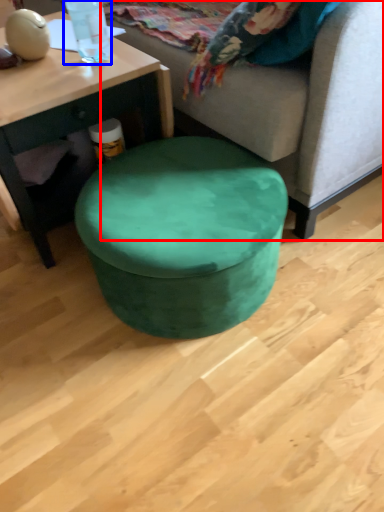
Question: Which of the following is the closest to the observer, studio couch (highlighted by a red box) or bottle (highlighted by a blue box)?

Choices:
 (A) studio couch
 (B) bottle

Answer: (A)